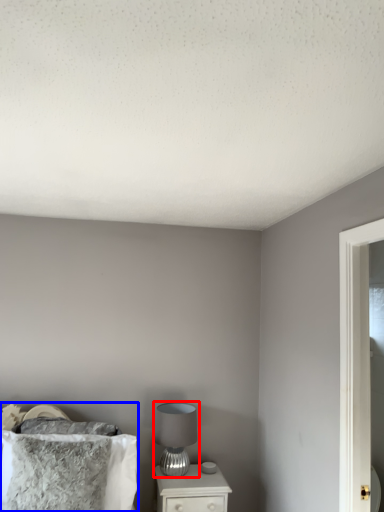
Question: Which point is closer to the camera, table lamp (highlighted by a red box) or bed (highlighted by a blue box)?

Choices:
 (A) table lamp
 (B) bed

Answer: (B)